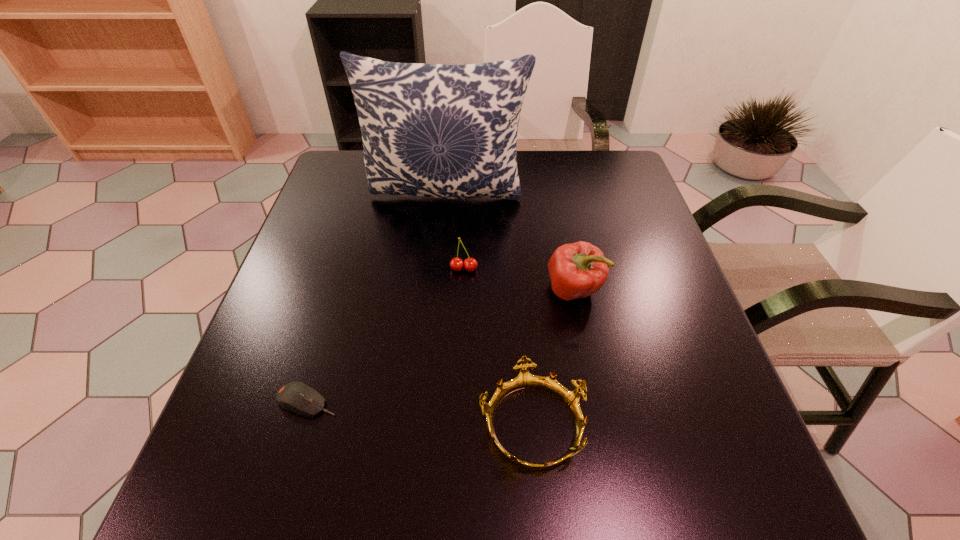
Where is `empty space between the crown and the farthest object`? empty space between the crown and the farthest object is located at coordinates (489, 310).

The width and height of the screenshot is (960, 540). I want to click on vacant point located between the computer mouse and the bell pepper, so pos(441,346).

I want to click on free space between the computer mouse and the crown, so click(420, 412).

Where is `the closest object to the farthest object`? the closest object to the farthest object is located at coordinates (470, 264).

Identify the location of object that is the third closest one to the third shortest object. The width and height of the screenshot is (960, 540). (524, 380).

Identify the location of blank area in the image that satisfies the following two spatial constraints: 1. on the front surface of the second tallest object; 2. on the right side of the cushion. This screenshot has height=540, width=960. (438, 290).

Identify the location of vacant space that satisfies the following two spatial constraints: 1. on the front surface of the cushion; 2. on the right side of the second shortest object. (426, 423).

I want to click on vacant space that satisfies the following two spatial constraints: 1. on the front surface of the tallest object; 2. on the right side of the crown, so click(426, 423).